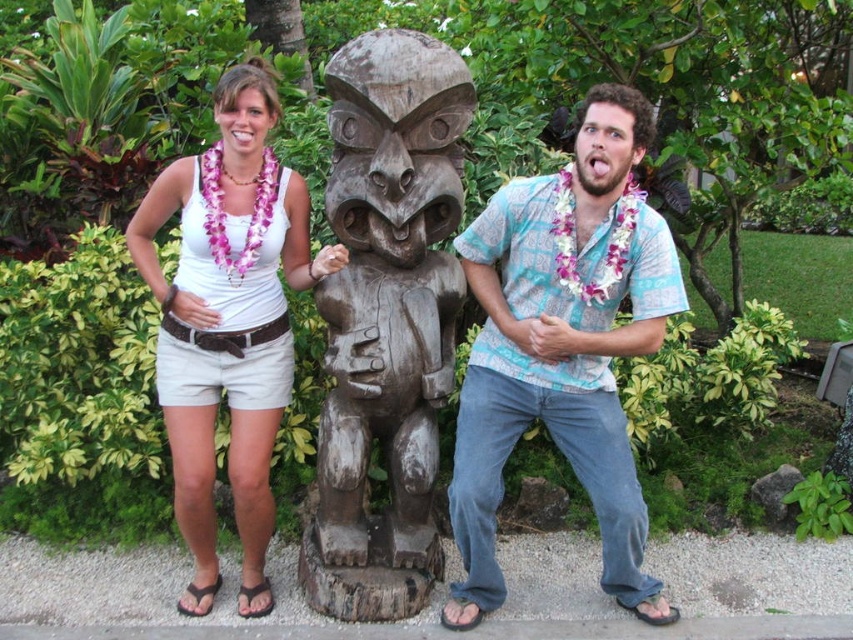
Who is shorter, wooden carving at center or white fabric top at center?

With less height is white fabric top at center.

Is wooden carving at center shorter than white fabric top at center?

No.

Identify the location of wooden carving at center. (386, 320).

Who is lower down, matte blue shirt at center or white fabric top at center?

matte blue shirt at center is below.

This screenshot has width=853, height=640. What are the coordinates of `matte blue shirt at center` in the screenshot? It's located at (563, 346).

Consider the image. Who is more distant from viewer, [476,618] or [260,346]?

Point [260,346]

Image resolution: width=853 pixels, height=640 pixels. I want to click on matte blue shirt at center, so click(x=563, y=346).

Which of these two, wooden statue at center or white fabric top at center, stands shorter?

With less height is white fabric top at center.

Consider the image. Can you confirm if wooden statue at center is positioned to the right of white fabric top at center?

Correct, you'll find wooden statue at center to the right of white fabric top at center.

Does point (329, 611) come in front of point (190, 589)?

That is True.

Where is `wooden statue at center`? This screenshot has width=853, height=640. wooden statue at center is located at coordinates (563, 346).